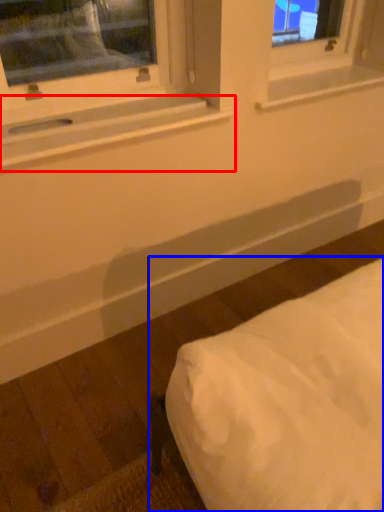
Question: Which object appears farthest to the camera in this image, window sill (highlighted by a red box) or furniture (highlighted by a blue box)?

Choices:
 (A) window sill
 (B) furniture

Answer: (A)